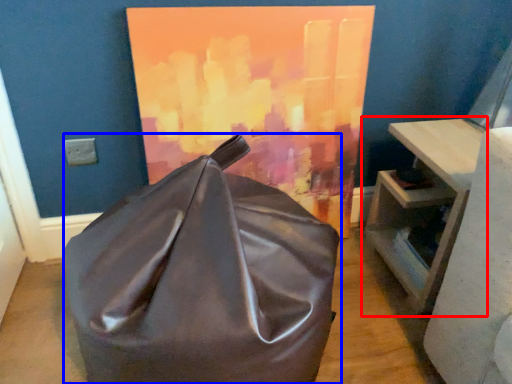
Question: Among these objects, which one is nearest to the camera, table (highlighted by a red box) or furniture (highlighted by a blue box)?

Choices:
 (A) table
 (B) furniture

Answer: (B)